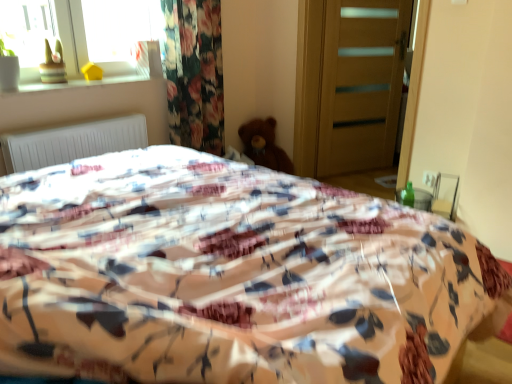
Question: From a real-world perspective, is transparent glass window at upper left physically below brown plush teddy bear at center?

Choices:
 (A) no
 (B) yes

Answer: (A)

Question: Is the depth of transparent glass window at upper left greater than that of brown plush teddy bear at center?

Choices:
 (A) yes
 (B) no

Answer: (B)

Question: Would you consider transparent glass window at upper left to be distant from brown plush teddy bear at center?

Choices:
 (A) no
 (B) yes

Answer: (B)

Question: Is transparent glass window at upper left to the right of brown plush teddy bear at center from the viewer's perspective?

Choices:
 (A) no
 (B) yes

Answer: (A)

Question: Can you confirm if transparent glass window at upper left is positioned to the left of brown plush teddy bear at center?

Choices:
 (A) yes
 (B) no

Answer: (A)

Question: Is transparent glass window at upper left turned away from brown plush teddy bear at center?

Choices:
 (A) yes
 (B) no

Answer: (B)

Question: From a real-world perspective, is transparent glass window at upper left on top of white matte radiator at upper left?

Choices:
 (A) yes
 (B) no

Answer: (A)

Question: Considering the relative sizes of transparent glass window at upper left and white matte radiator at upper left in the image provided, is transparent glass window at upper left bigger than white matte radiator at upper left?

Choices:
 (A) no
 (B) yes

Answer: (B)

Question: Can you confirm if transparent glass window at upper left is smaller than white matte radiator at upper left?

Choices:
 (A) no
 (B) yes

Answer: (A)

Question: Does transparent glass window at upper left have a lesser width compared to white matte radiator at upper left?

Choices:
 (A) no
 (B) yes

Answer: (B)

Question: Would you say transparent glass window at upper left contains white matte radiator at upper left?

Choices:
 (A) yes
 (B) no

Answer: (B)

Question: Considering the relative sizes of transparent glass window at upper left and white matte radiator at upper left in the image provided, is transparent glass window at upper left wider than white matte radiator at upper left?

Choices:
 (A) no
 (B) yes

Answer: (A)

Question: Can you confirm if brown plush teddy bear at center is smaller than wooden door at center?

Choices:
 (A) yes
 (B) no

Answer: (A)